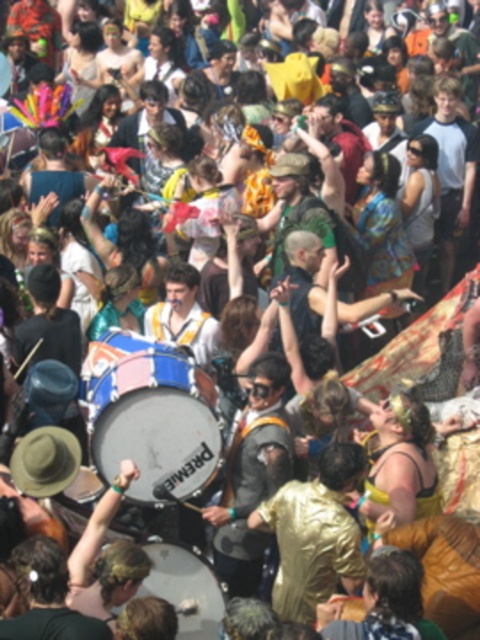
Question: Does matte blue drum at center lie behind white drum at center?

Choices:
 (A) no
 (B) yes

Answer: (B)

Question: Which point appears farthest from the camera in this image?

Choices:
 (A) (212, 573)
 (B) (204, 401)

Answer: (B)

Question: Which point is closer to the camera?

Choices:
 (A) matte blue drum at center
 (B) white drum at center

Answer: (B)

Question: Does matte blue drum at center come behind white drum at center?

Choices:
 (A) no
 (B) yes

Answer: (B)

Question: Is matte blue drum at center thinner than white drum at center?

Choices:
 (A) no
 (B) yes

Answer: (A)

Question: Among these objects, which one is farthest from the camera?

Choices:
 (A) white drum at center
 (B) matte blue drum at center

Answer: (B)